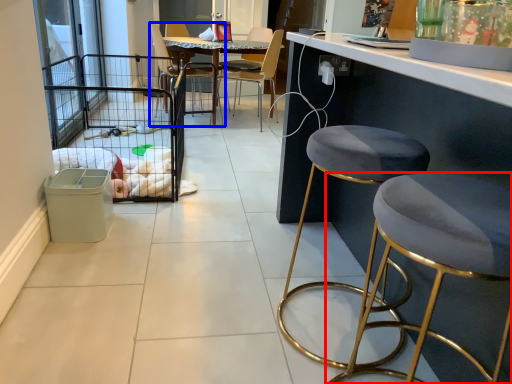
Question: Which object appears farthest to the camera in this image, stool (highlighted by a red box) or chair (highlighted by a blue box)?

Choices:
 (A) stool
 (B) chair

Answer: (B)